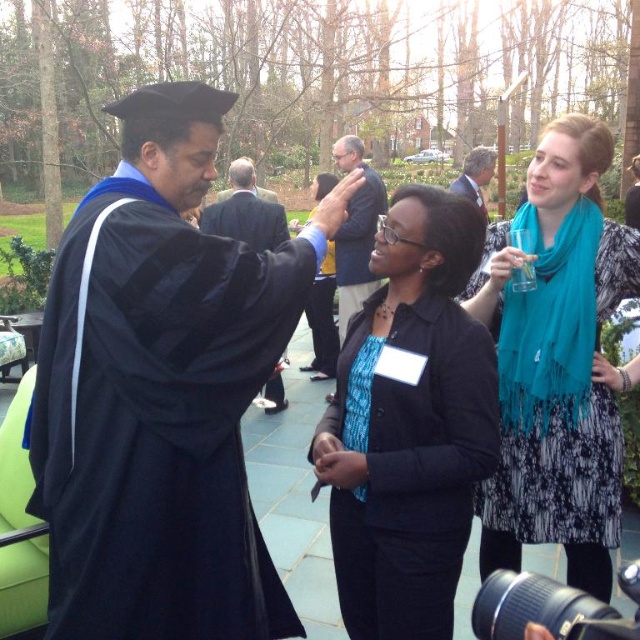
Does black matte suit at center have a greater height compared to gray wool suit at center?

Indeed, black matte suit at center has a greater height compared to gray wool suit at center.

Is black matte suit at center to the right of gray wool suit at center from the viewer's perspective?

No, black matte suit at center is not to the right of gray wool suit at center.

Which is in front, point (280, 392) or point (468, 164)?

Positioned in front is point (280, 392).

The width and height of the screenshot is (640, 640). Identify the location of black matte suit at center. (244, 212).

Can you confirm if matte black graduation gown at left is smaller than gray wool suit at center?

No, matte black graduation gown at left is not smaller than gray wool suit at center.

Can you confirm if matte black graduation gown at left is positioned above gray wool suit at center?

No.

Who is more forward, (275, 353) or (467, 172)?

Point (275, 353) is in front.

What are the coordinates of `matte black graduation gown at left` in the screenshot? It's located at (161, 392).

Who is positioned more to the left, matte black graduation gown at left or black matte suit at center?

From the viewer's perspective, black matte suit at center appears more on the left side.

Measure the distance between point (x=234, y=100) and camera.

Point (x=234, y=100) is 6.17 feet away from camera.

Where is `matte black graduation gown at left`? This screenshot has height=640, width=640. matte black graduation gown at left is located at coordinates (161, 392).